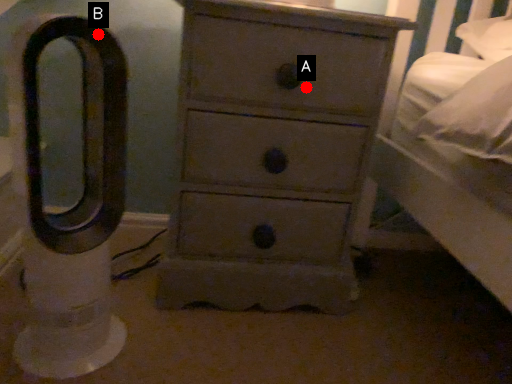
Question: Two points are circled on the image, labeled by A and B beside each circle. Which point is closer to the camera?

Choices:
 (A) A is closer
 (B) B is closer

Answer: (B)